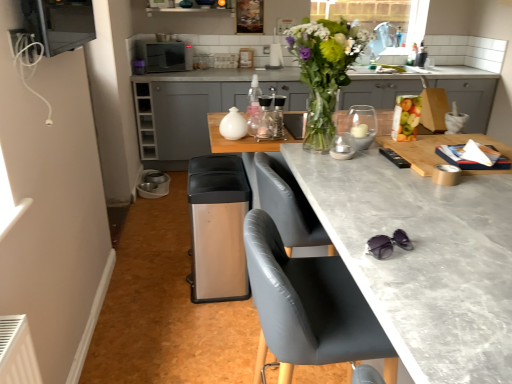
Question: Is white glossy jar at center, which appears as the second appliance when viewed from the right, in front of or behind satin black microwave at upper center in the image?

Choices:
 (A) behind
 (B) front

Answer: (B)

Question: From the image's perspective, is white glossy jar at center, which ranks as the second appliance in top-to-bottom order, positioned above or below satin black microwave at upper center?

Choices:
 (A) above
 (B) below

Answer: (B)

Question: Which is farther from the matte gray countertop at center?

Choices:
 (A) clear glass spray bottle at center
 (B) metallic silver microwave at upper left, acting as the 4th appliance starting from the back
 (C) translucent glass candle holder at center, the 3th appliance from the top
 (D) matte gray cabinets at center
 (E) satin black microwave at upper center

Answer: (E)

Question: Which of these objects is positioned farthest from the white glossy jar at center, which ranks as the second appliance in top-to-bottom order?

Choices:
 (A) matte gray countertop at center
 (B) satin black microwave at upper center
 (C) translucent plastic bag of assorted fruits at right
 (D) translucent glass candle holder at center, positioned as the 3th appliance in back-to-front order
 (E) matte gray cabinets at center

Answer: (B)